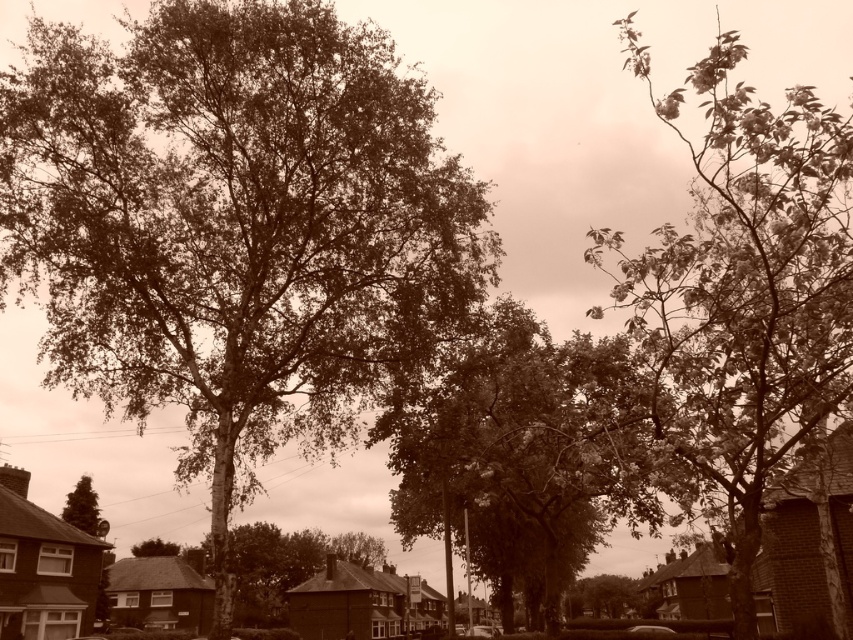
Question: In this image, where is green leafy tree at center located relative to green leafy tree at lower left?

Choices:
 (A) below
 (B) above

Answer: (B)

Question: Is green leafy tree at center below green leafy tree at upper right?

Choices:
 (A) no
 (B) yes

Answer: (B)

Question: Which is farther from the green leafy tree at center?

Choices:
 (A) green leafy tree at lower left
 (B) green leafy tree at upper right

Answer: (A)

Question: Can you confirm if green leafy tree at center is thinner than green leafy tree at lower left?

Choices:
 (A) yes
 (B) no

Answer: (B)

Question: Which of these objects is positioned closest to the green leafy tree at center?

Choices:
 (A) green leafy tree at upper right
 (B) green leafy tree at lower left

Answer: (A)

Question: Which point is closer to the camera?

Choices:
 (A) green leafy tree at upper right
 (B) green leafy tree at lower left

Answer: (A)